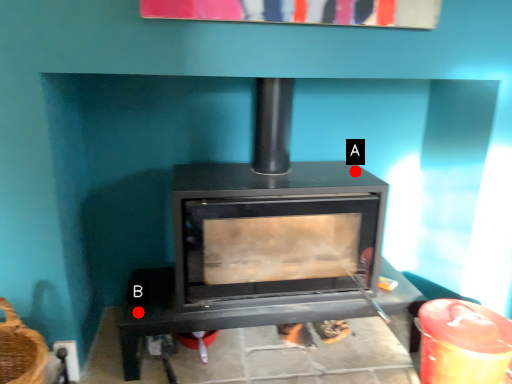
Question: Two points are circled on the image, labeled by A and B beside each circle. Which point is farther from the camera taking this photo?

Choices:
 (A) A is further
 (B) B is further

Answer: (A)